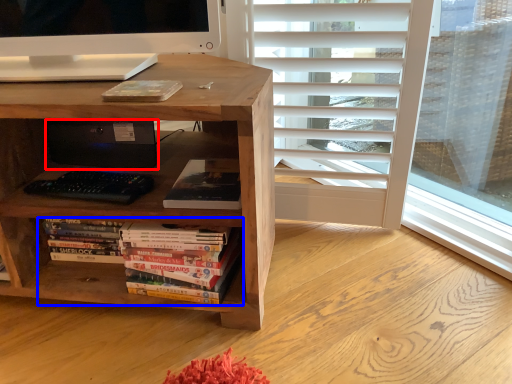
Question: Which point is further to the camera, computer (highlighted by a red box) or book (highlighted by a blue box)?

Choices:
 (A) computer
 (B) book

Answer: (A)